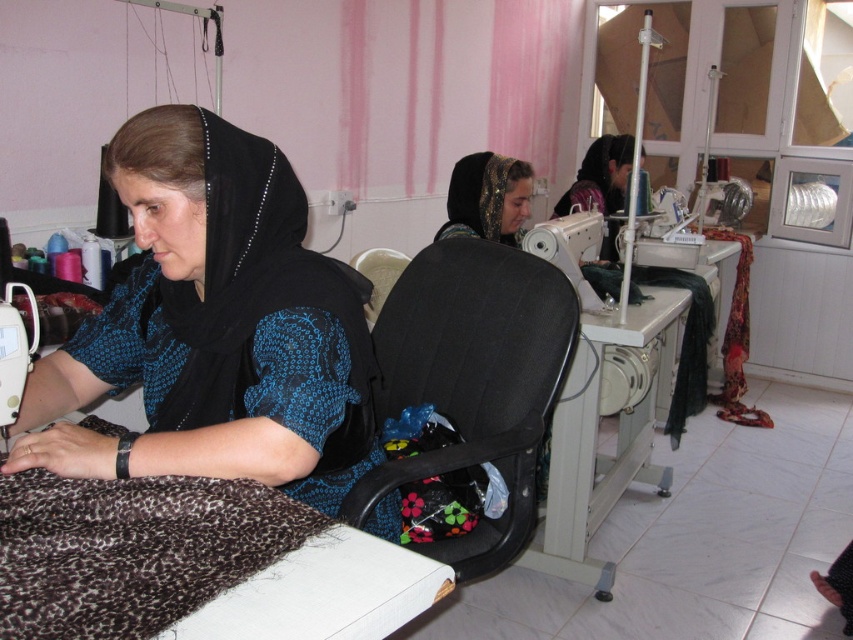
In the sewing workshop scene, where is the black lace dress at left located in terms of its 2D coordinates?

The black lace dress at left is located at the 2D coordinates point (215, 326).

You are a visitor in the sewing workshop and want to know which object is taller between the metallic gray sewing machine at center and the matte black headscarf at center. Can you tell me?

The metallic gray sewing machine at center is taller than the matte black headscarf at center.